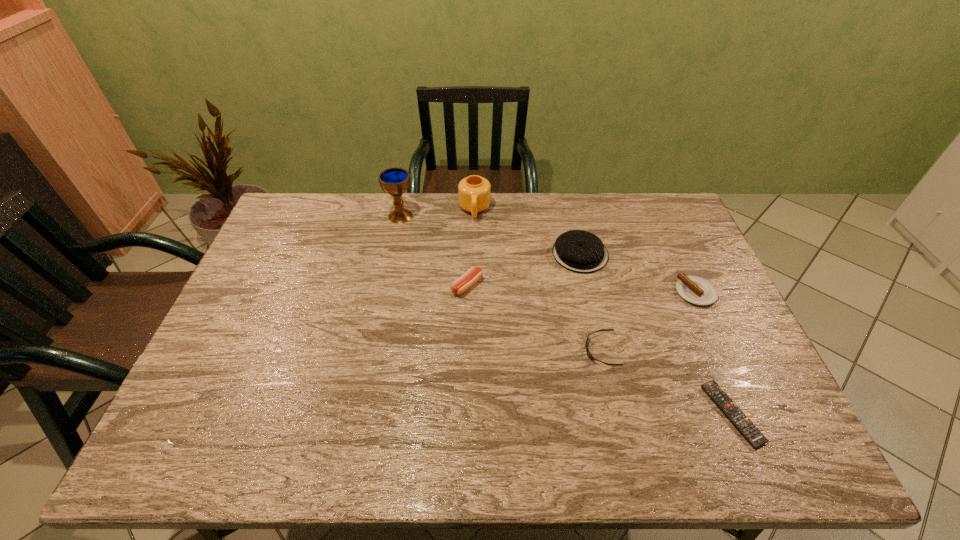
The height and width of the screenshot is (540, 960). Identify the location of remote control. (734, 414).

The height and width of the screenshot is (540, 960). Find the location of `the nearest object`. the nearest object is located at coordinates click(x=734, y=414).

At what (x,y) coordinates should I click in order to perform the action: click on free point located 0.080m on the front of the chalice. Please return your answer as a coordinate pair (x, y). Looking at the image, I should click on (396, 240).

I want to click on blank area located 0.070m on the handle side of the sixth shortest object, so click(474, 237).

At what (x,y) coordinates should I click in order to perform the action: click on free space located 0.120m on the front of the third tallest object. Please return your answer as a coordinate pair (x, y). The height and width of the screenshot is (540, 960). Looking at the image, I should click on (591, 303).

The height and width of the screenshot is (540, 960). Find the location of `vacant space situated on the left of the taller sausage`. vacant space situated on the left of the taller sausage is located at coordinates (425, 286).

At what (x,y) coordinates should I click in order to perform the action: click on vacant region located on the left of the third shortest object. Please return your answer as a coordinate pair (x, y). This screenshot has height=540, width=960. Looking at the image, I should click on (649, 292).

You are a GUI agent. You are given a task and a screenshot of the screen. Output one action in this format:
    pyautogui.click(x=<x>, y=<y>)
    Task: Click on the vacant space located 0.300m on the front-facing side of the sixth farthest object
    
    Given the screenshot: What is the action you would take?
    pyautogui.click(x=474, y=350)

Where is `blank area located on the front-facing side of the sixth farthest object`? The height and width of the screenshot is (540, 960). blank area located on the front-facing side of the sixth farthest object is located at coordinates (544, 350).

What are the coordinates of `free spot located on the front-facing side of the sixth farthest object` in the screenshot? It's located at (441, 350).